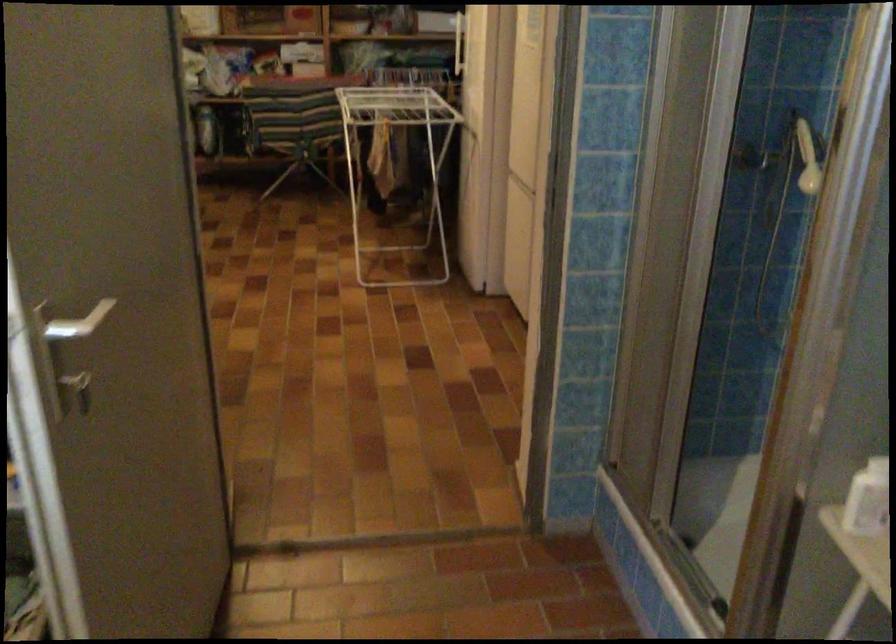
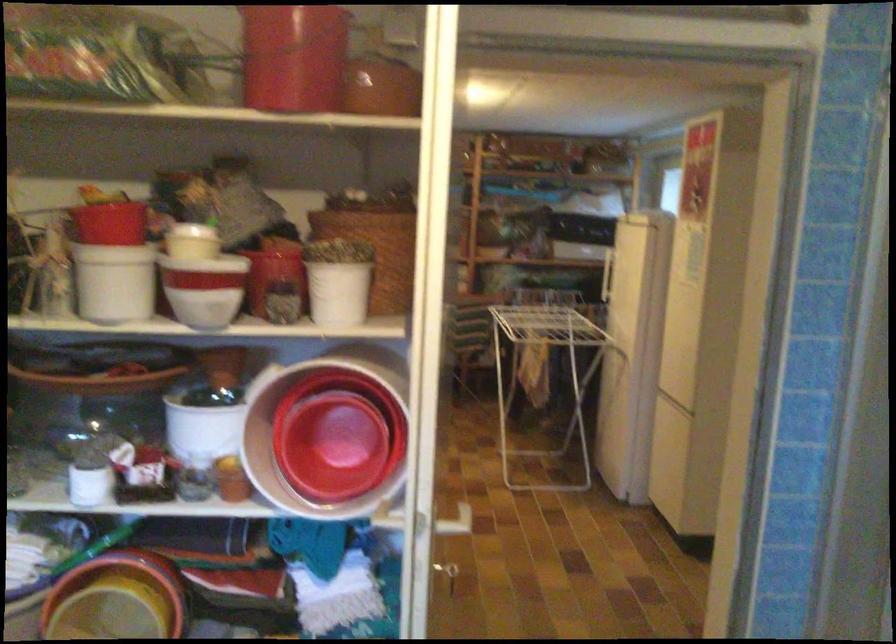
Where in the second image is the point corresponding to point (390, 169) from the first image?

(545, 375)